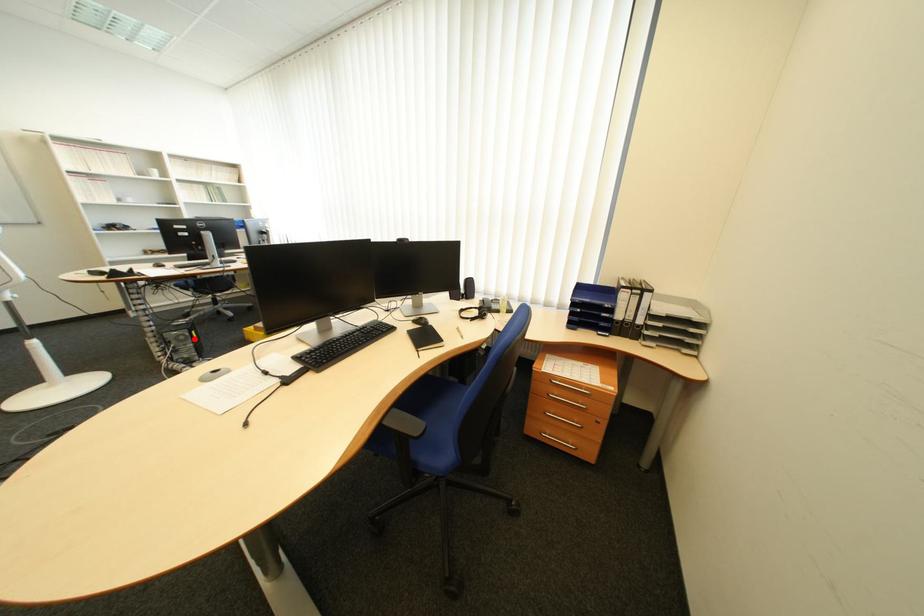
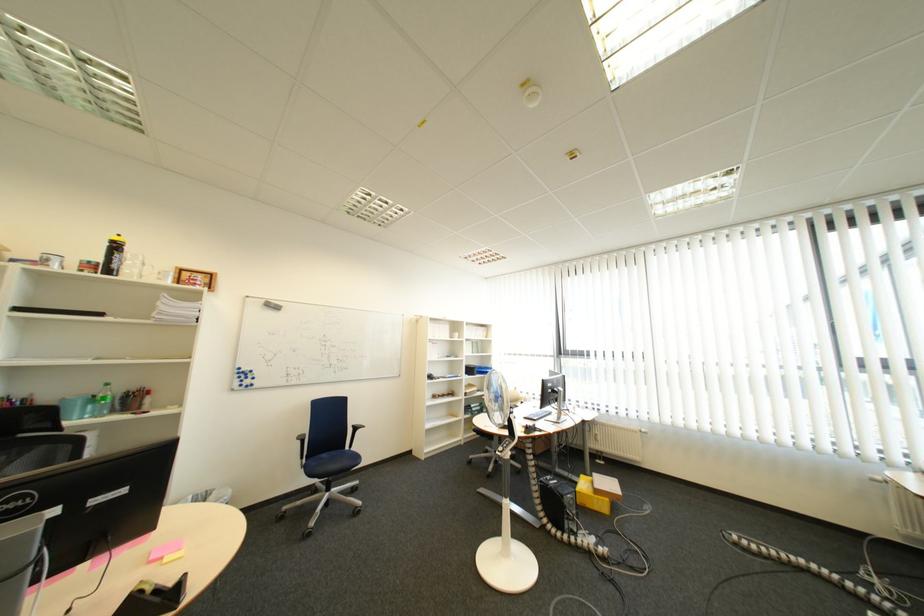
Question: I am providing you with two images of the same scene from different viewpoints. Image1 has a red point marked. In image2, the corresponding 3D location appears at what relative position? Reply with the corresponding letter.

Choices:
 (A) Closer
 (B) Farther

Answer: (B)